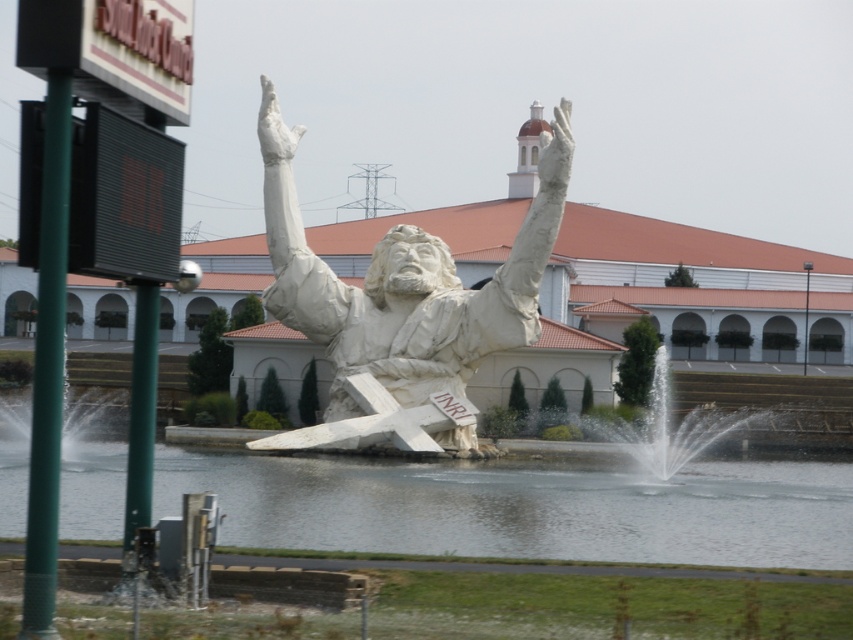
You are a photographer planning to take a photo of the white marble statue arm at center and the clear water at center. Which object should you focus on first if you want to capture both in the same frame without moving the camera?

The clear water at center has a larger size compared to the white marble statue arm at center, so you should focus on the clear water at center first to ensure it fills the frame appropriately before adjusting for the smaller statue arm.

You are a photographer planning to take a photo of the white marble statue at center and the clear water at center. Based on their heights, which object should you focus on first if you want to ensure both are in frame without moving the camera?

The clear water at center is shorter than the white marble statue at center, so you should focus on the white marble statue at center first to ensure both are in frame.

You are standing in front of the statue and want to get a drink of water. Where should you look for the clear water at center?

The clear water at center is located at the coordinates point (524, 508).